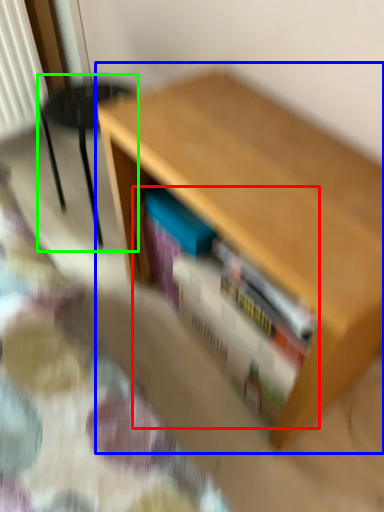
Question: Which object is the farthest from book (highlighted by a red box)? Choose among these: table (highlighted by a blue box) or armchair (highlighted by a green box).

Choices:
 (A) table
 (B) armchair

Answer: (B)